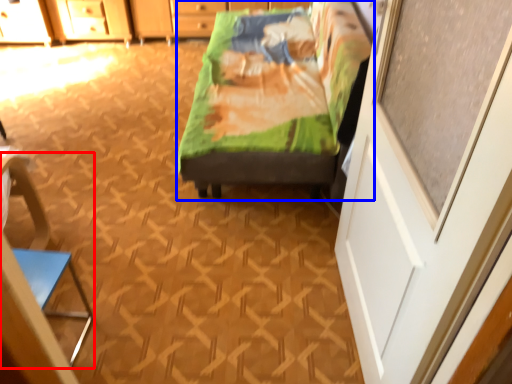
Question: Which of the following is the farthest to the observer, armchair (highlighted by a red box) or furniture (highlighted by a blue box)?

Choices:
 (A) armchair
 (B) furniture

Answer: (B)